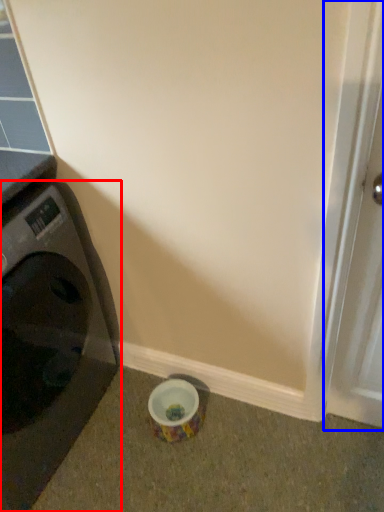
Question: Which object is further to the camera taking this photo, washing machine (highlighted by a red box) or screen door (highlighted by a blue box)?

Choices:
 (A) washing machine
 (B) screen door

Answer: (A)